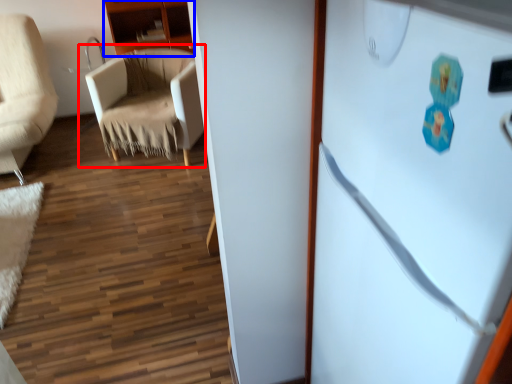
Question: Which point is closer to the camera, chair (highlighted by a red box) or cabinetry (highlighted by a blue box)?

Choices:
 (A) chair
 (B) cabinetry

Answer: (A)